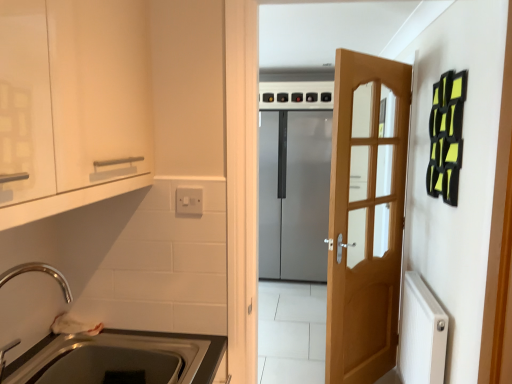
Describe the element at coordinates (190, 338) in the screenshot. This screenshot has height=384, width=512. I see `metallic stainless steel sink at lower left` at that location.

Measure the distance between black plastic knob at upper center, the third knob from the left, and camera.

The depth of black plastic knob at upper center, the third knob from the left, is 13.92 feet.

How much space does black plastic knob at upper center, placed as the first knob when sorted from left to right, occupy vertically?

black plastic knob at upper center, placed as the first knob when sorted from left to right, is 12.77 centimeters in height.

What do you see at coordinates (189, 201) in the screenshot? Image resolution: width=512 pixels, height=384 pixels. I see `white plastic switch at upper center` at bounding box center [189, 201].

What do you see at coordinates (366, 216) in the screenshot? The width and height of the screenshot is (512, 384). I see `wooden door at center` at bounding box center [366, 216].

This screenshot has height=384, width=512. What do you see at coordinates (40, 271) in the screenshot?
I see `chrome metallic faucet at lower left` at bounding box center [40, 271].

Locate an element on the screen. Image resolution: width=512 pixels, height=384 pixels. chrome metallic faucet at lower left is located at coordinates (40, 271).

This screenshot has width=512, height=384. I want to click on white glossy cabinet at upper left, so click(x=72, y=105).

Is point (331, 99) positioned after point (189, 200)?

Yes, point (331, 99) is behind point (189, 200).

Which knob is the 1st one when counting from the back of the white plastic switch at upper center? Please provide its 2D coordinates.

[(326, 97)]

From a real-world perspective, is black plastic knob at upper center, the third knob from the left, physically located above or below white plastic switch at upper center?

Clearly, from a real-world perspective, black plastic knob at upper center, the third knob from the left, is above white plastic switch at upper center.

At what (x,y) coordinates should I click in order to perform the action: click on faucet in front of the black plastic knob at upper center, the first knob from the right. Please return your answer as a coordinate pair (x, y). Looking at the image, I should click on (40, 271).

In terms of size, does black plastic knob at upper center, the first knob from the right, appear bigger or smaller than chrome metallic faucet at lower left?

Clearly, black plastic knob at upper center, the first knob from the right, is smaller in size than chrome metallic faucet at lower left.

Is black plastic knob at upper center, the third knob from the left, next to chrome metallic faucet at lower left and touching it?

No, black plastic knob at upper center, the third knob from the left, is not beside chrome metallic faucet at lower left.

Do you think black plastic knob at upper center, the first knob from the right, is within chrome metallic faucet at lower left, or outside of it?

black plastic knob at upper center, the first knob from the right, is not enclosed by chrome metallic faucet at lower left.

Based on the photo, are metallic stainless steel sink at lower left and chrome metallic faucet at lower left making contact?

No.

From the image's perspective, is metallic stainless steel sink at lower left located above chrome metallic faucet at lower left?

Actually, metallic stainless steel sink at lower left appears below chrome metallic faucet at lower left in the image.

From a real-world perspective, is metallic stainless steel sink at lower left above or below chrome metallic faucet at lower left?

From a real-world perspective, metallic stainless steel sink at lower left is physically below chrome metallic faucet at lower left.

Could you tell me if wooden door at center is turned towards black plastic knob at upper center, the third knob from the left?

No, wooden door at center is not oriented towards black plastic knob at upper center, the third knob from the left.

Is wooden door at center far from black plastic knob at upper center, the first knob from the right?

Absolutely, wooden door at center is distant from black plastic knob at upper center, the first knob from the right.

Does wooden door at center come behind black plastic knob at upper center, the first knob from the right?

No.

You are a GUI agent. You are given a task and a screenshot of the screen. Output one action in this format:
    pyautogui.click(x=<x>, y=<y>)
    Task: Click on the knob that is the 1st one when counting backward from the wooden door at center
    This screenshot has width=512, height=384.
    Given the screenshot: What is the action you would take?
    pyautogui.click(x=326, y=97)

Does wooden door at center come in front of chrome metallic faucet at lower left?

No, it is behind chrome metallic faucet at lower left.

Locate an element on the screen. Image resolution: width=512 pixels, height=384 pixels. door on the right of chrome metallic faucet at lower left is located at coordinates (366, 216).

From the image's perspective, who appears lower, wooden door at center or chrome metallic faucet at lower left?

chrome metallic faucet at lower left, from the image's perspective.

Is point (32, 354) closer or farther from the camera than point (327, 92)?

Point (32, 354) is closer to the camera than point (327, 92).

Considering the relative sizes of metallic stainless steel sink at lower left and black plastic knob at upper center, the third knob from the left, in the image provided, is metallic stainless steel sink at lower left wider than black plastic knob at upper center, the third knob from the left,?

Yes, metallic stainless steel sink at lower left is wider than black plastic knob at upper center, the third knob from the left.

Consider the image. Considering the relative positions of metallic stainless steel sink at lower left and black plastic knob at upper center, the third knob from the left, in the image provided, is metallic stainless steel sink at lower left to the left of black plastic knob at upper center, the third knob from the left, from the viewer's perspective?

Yes.

Is metallic stainless steel sink at lower left looking in the opposite direction of black plastic knob at upper center, the first knob from the right?

No, black plastic knob at upper center, the first knob from the right, is not at the back of metallic stainless steel sink at lower left.

Is point (268, 98) more distant than point (160, 334)?

That is True.

Are black plastic knob at upper center, which ranks as the third knob in right-to-left order, and metallic stainless steel sink at lower left located far from each other?

Yes, black plastic knob at upper center, which ranks as the third knob in right-to-left order, is far from metallic stainless steel sink at lower left.

Based on their positions, is black plastic knob at upper center, placed as the first knob when sorted from left to right, located to the left or right of metallic stainless steel sink at lower left?

black plastic knob at upper center, placed as the first knob when sorted from left to right, is positioned on metallic stainless steel sink at lower left's right side.

Can you confirm if black plastic knob at upper center, which ranks as the third knob in right-to-left order, is thinner than metallic stainless steel sink at lower left?

Yes.

Image resolution: width=512 pixels, height=384 pixels. What are the coordinates of `knob that is the 2nd object above the white plastic switch at upper center (from a real-world perspective)` in the screenshot? It's located at click(326, 97).

From the image's perspective, which knob is the 1st one above the chrome metallic faucet at lower left? Please provide its 2D coordinates.

[(326, 97)]

Consider the image. Looking at the image, which one is located further to black plastic knob at upper center, the first knob from the right, white glossy cabinet at upper left or satin silver refrigerator at center?

Based on the image, white glossy cabinet at upper left appears to be further to black plastic knob at upper center, the first knob from the right.

Considering their positions, is white glossy cabinet at upper left positioned closer to white plastic switch at upper center than black plastic knob at upper center, the first knob from the right?

The object closer to white plastic switch at upper center is white glossy cabinet at upper left.

From the image, which object appears to be nearer to black plastic knob at upper center, which appears as the 2th knob when viewed from the left, white glossy cabinet at upper left or black plastic knob at upper center, the third knob from the left?

Among the two, black plastic knob at upper center, the third knob from the left, is located nearer to black plastic knob at upper center, which appears as the 2th knob when viewed from the left.

Estimate the real-world distances between objects in this image. Which object is further from black plastic knob at upper center, which ranks as the second knob in right-to-left order, white glossy cabinet at upper left or chrome metallic faucet at lower left?

Based on the image, white glossy cabinet at upper left appears to be further to black plastic knob at upper center, which ranks as the second knob in right-to-left order.

Looking at the image, which one is located closer to black plastic knob at upper center, which appears as the 2th knob when viewed from the left, satin silver refrigerator at center or wooden door at center?

satin silver refrigerator at center lies closer to black plastic knob at upper center, which appears as the 2th knob when viewed from the left, than the other object.

Looking at the image, which one is located closer to black plastic knob at upper center, which ranks as the third knob in right-to-left order, white glossy cabinet at upper left or black plastic knob at upper center, the first knob from the right?

black plastic knob at upper center, the first knob from the right, is positioned closer to the anchor black plastic knob at upper center, which ranks as the third knob in right-to-left order.

Which object lies nearer to the anchor point metallic stainless steel sink at lower left, satin silver refrigerator at center or wooden door at center?

The object closer to metallic stainless steel sink at lower left is wooden door at center.

Estimate the real-world distances between objects in this image. Which object is closer to wooden door at center, white glossy cabinet at upper left or black plastic knob at upper center, placed as the first knob when sorted from left to right?

Among the two, white glossy cabinet at upper left is located nearer to wooden door at center.

This screenshot has width=512, height=384. In order to click on electric outlet positioned between chrome metallic faucet at lower left and black plastic knob at upper center, the first knob from the right, from near to far in this screenshot , I will do `click(189, 201)`.

Where is `electric outlet located between metallic stainless steel sink at lower left and black plastic knob at upper center, placed as the first knob when sorted from left to right, in the depth direction`? electric outlet located between metallic stainless steel sink at lower left and black plastic knob at upper center, placed as the first knob when sorted from left to right, in the depth direction is located at coordinates (189, 201).

You are a GUI agent. You are given a task and a screenshot of the screen. Output one action in this format:
    pyautogui.click(x=<x>, y=<y>)
    Task: Click on the appliance between wooden door at center and black plastic knob at upper center, the first knob from the right, in the front-back direction
    
    Given the screenshot: What is the action you would take?
    pyautogui.click(x=294, y=181)

Locate an element on the screen. This screenshot has width=512, height=384. door between white plastic switch at upper center and black plastic knob at upper center, which ranks as the second knob in right-to-left order, from front to back is located at coordinates (366, 216).